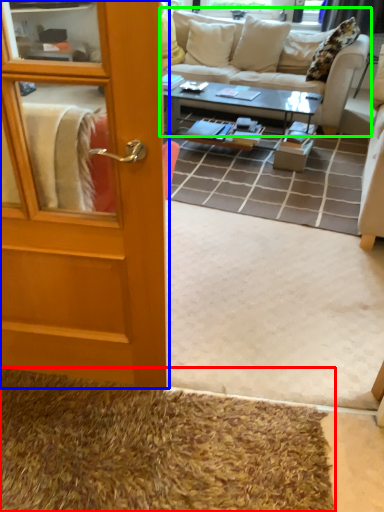
Question: Estimate the real-world distances between objects in this image. Which object is farther from doormat (highlighted by a red box), door (highlighted by a blue box) or studio couch (highlighted by a green box)?

Choices:
 (A) door
 (B) studio couch

Answer: (B)